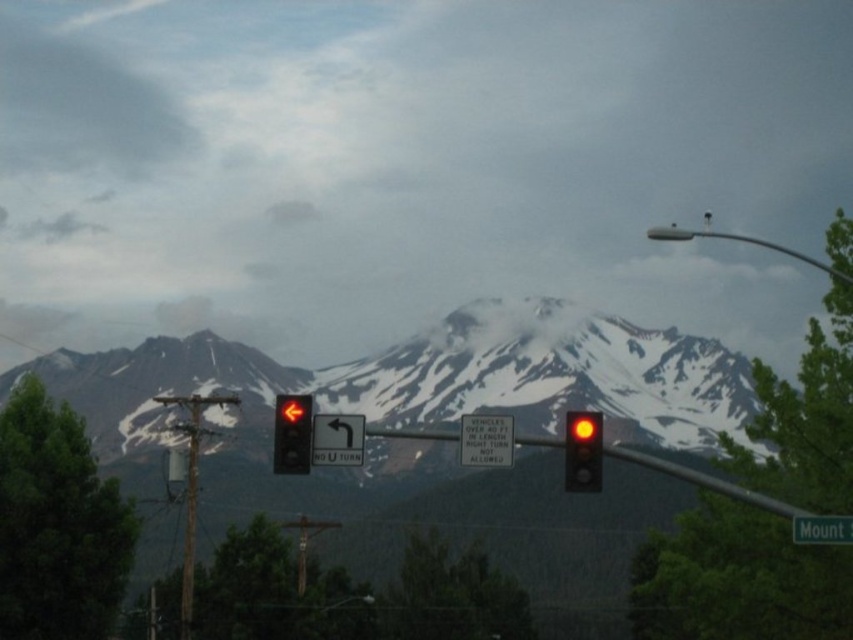
Is matte black arrow at left behind metallic pole at upper right?

No, it is in front of metallic pole at upper right.

Between point (276, 433) and point (809, 257), which one is positioned behind?

Point (809, 257)

Between point (296, 456) and point (830, 272), which one is positioned in front?

Point (296, 456) is in front.

Locate an element on the screen. This screenshot has height=640, width=853. matte black arrow at left is located at coordinates (292, 433).

Consider the image. Is black plastic traffic sign at center bigger than metallic pole at upper right?

Actually, black plastic traffic sign at center might be smaller than metallic pole at upper right.

Who is taller, black plastic traffic sign at center or metallic pole at upper right?

With more height is metallic pole at upper right.

Locate an element on the screen. This screenshot has width=853, height=640. black plastic traffic sign at center is located at coordinates (337, 440).

Between white plastic sign at center and green plastic sign at center, which one appears on the left side from the viewer's perspective?

white plastic sign at center is more to the left.

Is point (497, 428) closer to camera compared to point (851, 540)?

No, (497, 428) is further to viewer.

Where is `white plastic sign at center`? white plastic sign at center is located at coordinates (486, 440).